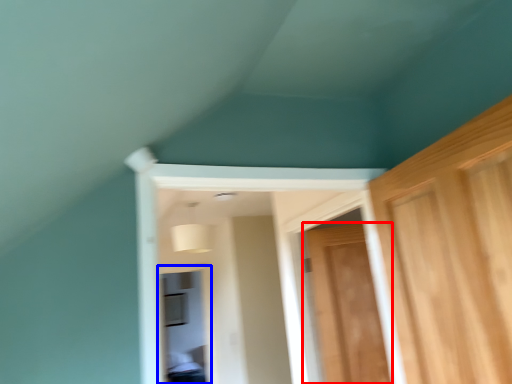
Question: Which object appears farthest to the camera in this image, door (highlighted by a red box) or window (highlighted by a blue box)?

Choices:
 (A) door
 (B) window

Answer: (B)